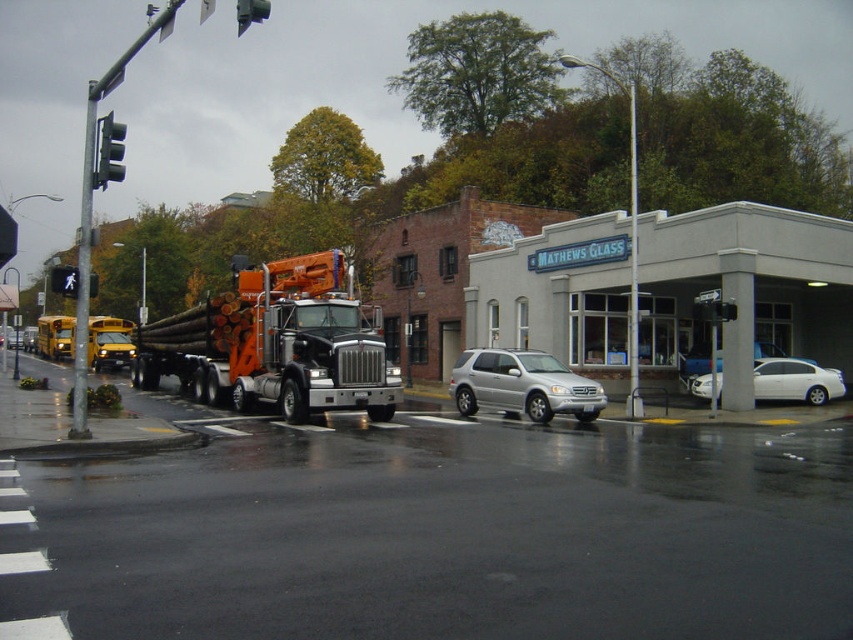
Question: Does silver metallic suv at center appear over black glass traffic light at upper left?

Choices:
 (A) yes
 (B) no

Answer: (B)

Question: Estimate the real-world distances between objects in this image. Which object is closer to the black plastic traffic light at upper center?

Choices:
 (A) black plastic traffic light at upper left
 (B) white matte sedan at lower right
 (C) black glass traffic light at upper left
 (D) orange metallic truck at center

Answer: (D)

Question: Which point is farther to the camera?

Choices:
 (A) black glass traffic light at upper left
 (B) white matte sedan at lower right
 (C) silver metallic suv at center
 (D) black plastic traffic light at upper center

Answer: (B)

Question: Which object is closer to the camera taking this photo?

Choices:
 (A) orange metallic truck at center
 (B) black plastic traffic light at upper center
 (C) black plastic traffic light at upper left

Answer: (B)

Question: Does white matte sedan at lower right appear on the left side of black plastic traffic light at upper left?

Choices:
 (A) no
 (B) yes

Answer: (A)

Question: Can you confirm if black plastic traffic light at upper center is wider than black plastic traffic light at upper left?

Choices:
 (A) no
 (B) yes

Answer: (A)